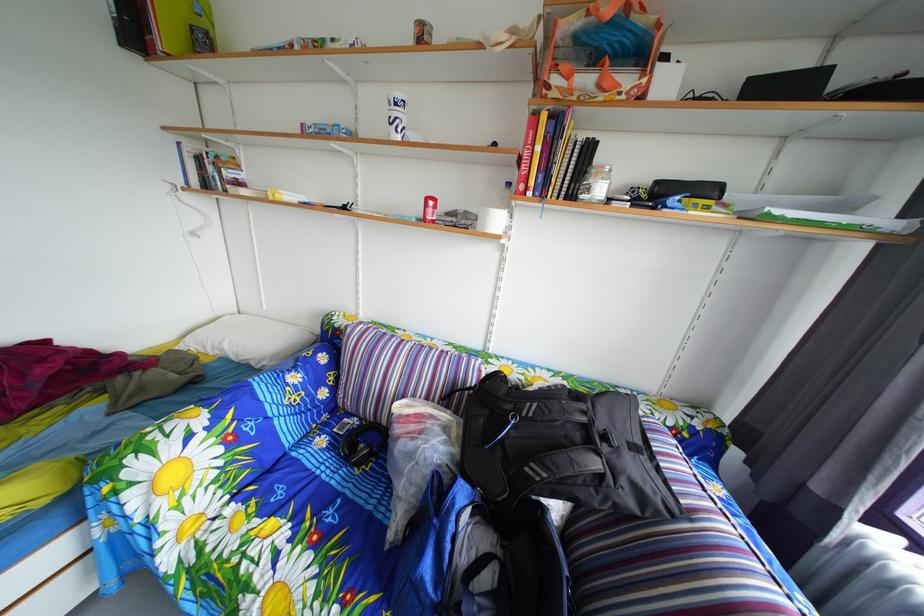
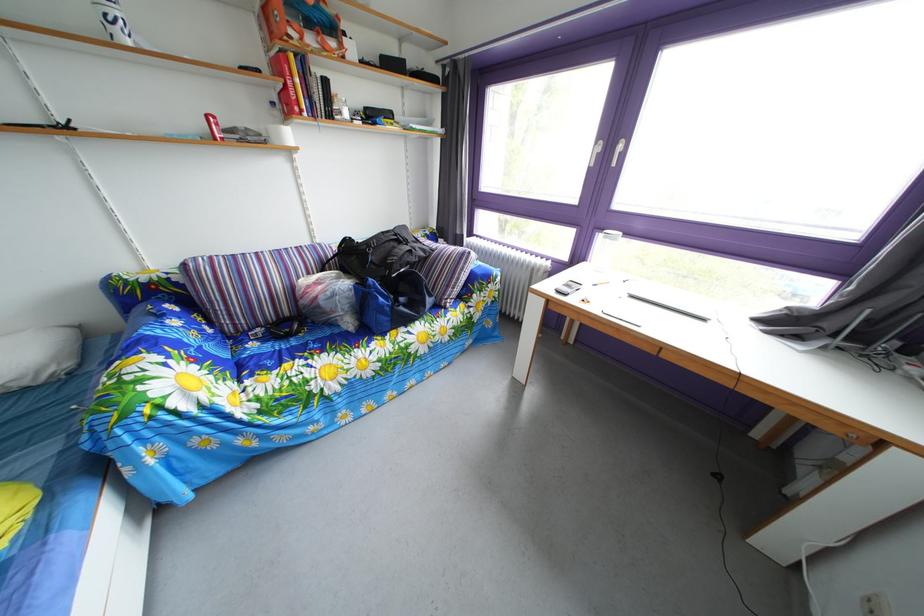
In the second image, find the point that corresponds to point (333, 448) in the first image.

(262, 353)